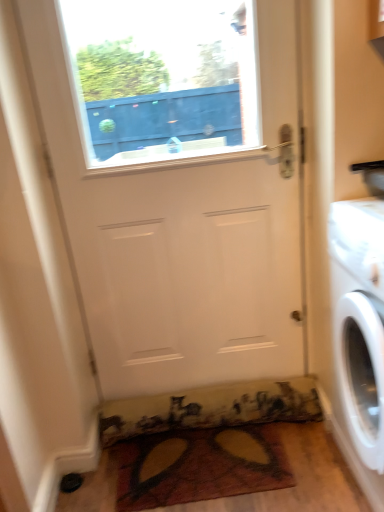
Question: From a real-world perspective, is multicolored fabric doormat at lower center, the first doormat from the top, over multicolored fabric doormat at lower center, which appears as the first doormat when ordered from the bottom?

Choices:
 (A) yes
 (B) no

Answer: (A)

Question: Can you confirm if multicolored fabric doormat at lower center, the second doormat in the bottom-to-top sequence, is smaller than multicolored fabric doormat at lower center, which appears as the first doormat when ordered from the bottom?

Choices:
 (A) yes
 (B) no

Answer: (B)

Question: Is multicolored fabric doormat at lower center, the first doormat from the top, thinner than multicolored fabric doormat at lower center, which appears as the first doormat when ordered from the bottom?

Choices:
 (A) yes
 (B) no

Answer: (A)

Question: From a real-world perspective, is multicolored fabric doormat at lower center, the second doormat in the bottom-to-top sequence, positioned under multicolored fabric doormat at lower center, which is the second doormat from top to bottom, based on gravity?

Choices:
 (A) no
 (B) yes

Answer: (A)

Question: Is multicolored fabric doormat at lower center, the first doormat from the top, shorter than multicolored fabric doormat at lower center, which appears as the first doormat when ordered from the bottom?

Choices:
 (A) no
 (B) yes

Answer: (A)

Question: Considering the positions of point click(294, 365) and point click(120, 461), is point click(294, 365) closer or farther from the camera than point click(120, 461)?

Choices:
 (A) closer
 (B) farther

Answer: (B)

Question: Is white matte door at center inside the boundaries of multicolored fabric doormat at lower center, which is the second doormat from top to bottom, or outside?

Choices:
 (A) outside
 (B) inside

Answer: (A)

Question: From a real-world perspective, is white matte door at center positioned above or below multicolored fabric doormat at lower center, which is the second doormat from top to bottom?

Choices:
 (A) below
 (B) above

Answer: (B)

Question: Based on their sizes in the image, would you say white matte door at center is bigger or smaller than multicolored fabric doormat at lower center, which is the second doormat from top to bottom?

Choices:
 (A) small
 (B) big

Answer: (B)

Question: Is white matte door at center taller or shorter than white glossy washing machine at right?

Choices:
 (A) short
 (B) tall

Answer: (B)

Question: Based on their positions, is white matte door at center located to the left or right of white glossy washing machine at right?

Choices:
 (A) right
 (B) left

Answer: (B)

Question: Is point (72, 195) closer or farther from the camera than point (362, 342)?

Choices:
 (A) farther
 (B) closer

Answer: (A)

Question: From a real-world perspective, is white matte door at center positioned above or below white glossy washing machine at right?

Choices:
 (A) above
 (B) below

Answer: (A)

Question: Considering the relative positions of white glossy washing machine at right and multicolored fabric doormat at lower center, which appears as the first doormat when ordered from the bottom, in the image provided, is white glossy washing machine at right to the left or to the right of multicolored fabric doormat at lower center, which appears as the first doormat when ordered from the bottom,?

Choices:
 (A) right
 (B) left

Answer: (A)

Question: From the image's perspective, relative to multicolored fabric doormat at lower center, which appears as the first doormat when ordered from the bottom, is white glossy washing machine at right above or below?

Choices:
 (A) below
 (B) above

Answer: (B)